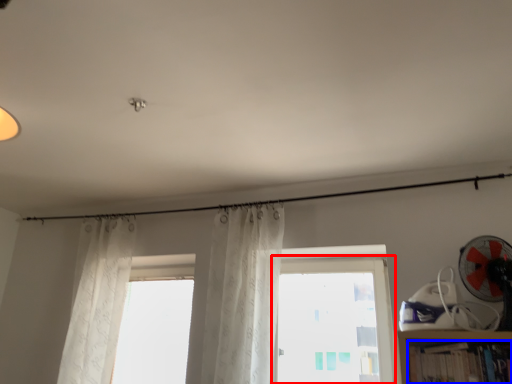
Question: Which of the following is the farthest to the observer, window (highlighted by a red box) or book (highlighted by a blue box)?

Choices:
 (A) window
 (B) book

Answer: (A)